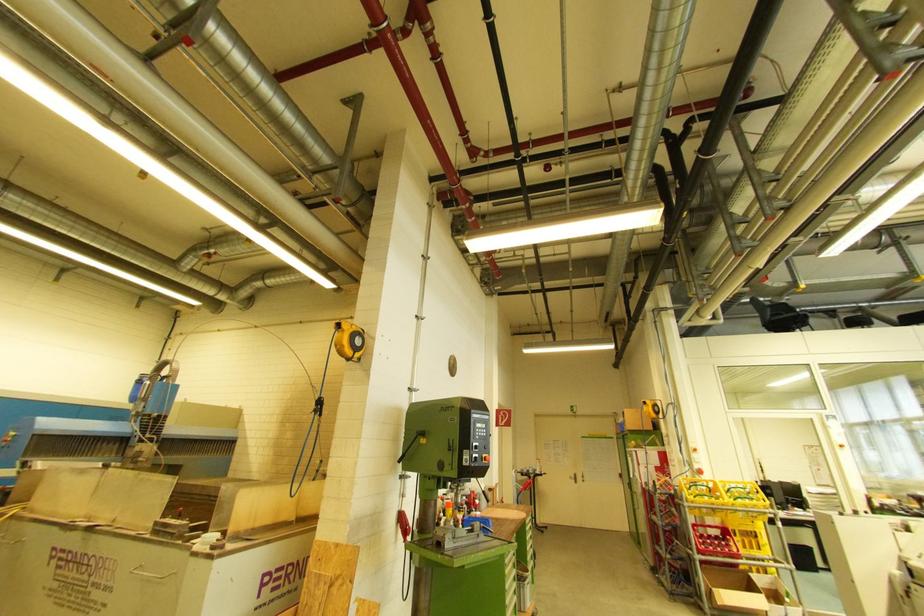
Find the location of `chair sitting surface`. chair sitting surface is located at coordinates (779, 315).